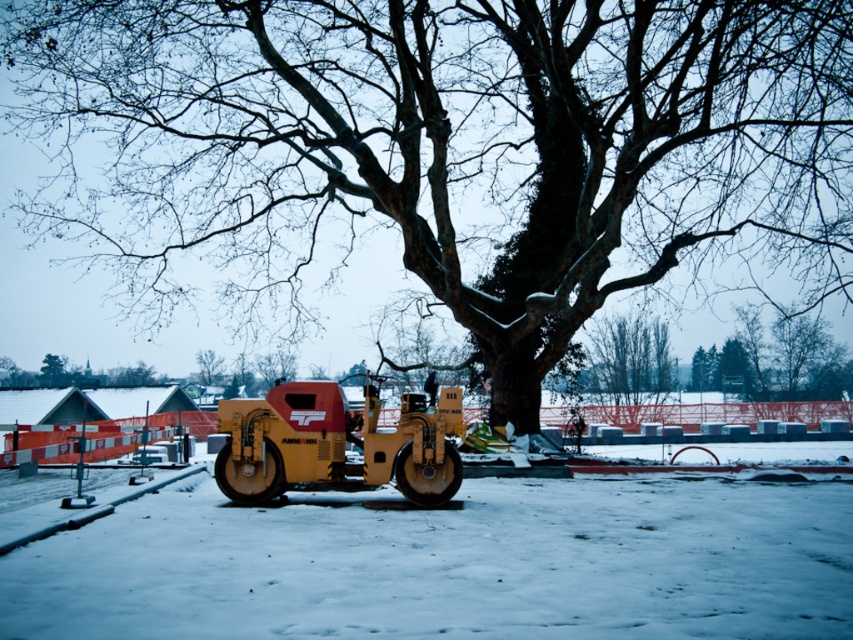
Question: Does smooth bark tree at center appear over white matte snow at center?

Choices:
 (A) yes
 (B) no

Answer: (A)

Question: Which point is farther to the camera?

Choices:
 (A) (165, 216)
 (B) (477, 582)
 (C) (419, 426)
 (D) (216, 358)

Answer: (D)

Question: Is white matte snow at center thinner than yellow rubber steamroller at center?

Choices:
 (A) yes
 (B) no

Answer: (B)

Question: Which is nearer to the smooth bark tree at center?

Choices:
 (A) green leafy tree at center
 (B) white matte snow at center
 (C) yellow rubber steamroller at center

Answer: (B)

Question: Is smooth bark tree at center behind green leafy tree at center?

Choices:
 (A) no
 (B) yes

Answer: (A)

Question: Estimate the real-world distances between objects in this image. Which object is closer to the white matte snow at center?

Choices:
 (A) yellow rubber steamroller at center
 (B) green leafy tree at center

Answer: (A)